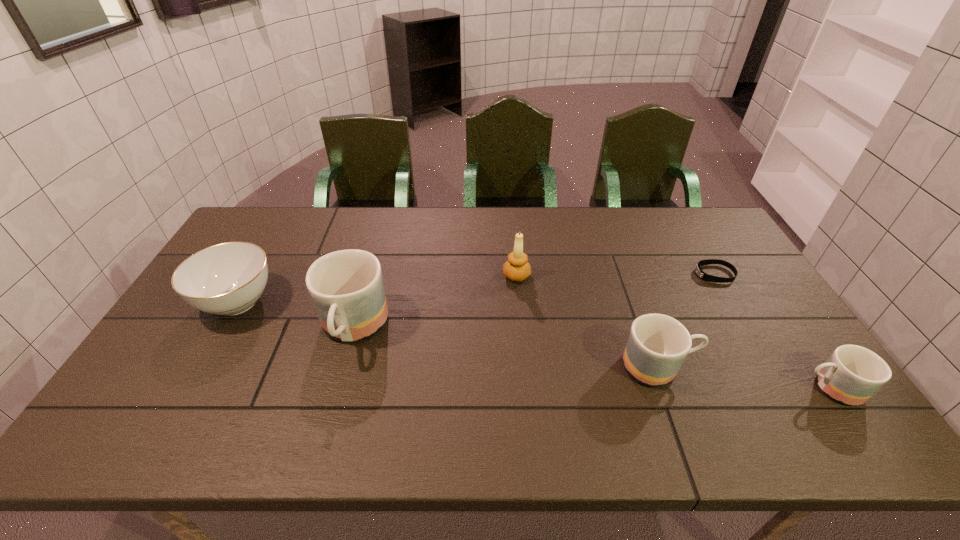
Identify the location of vacant spot for a new mug to ensure equal spacing. This screenshot has width=960, height=540. (499, 347).